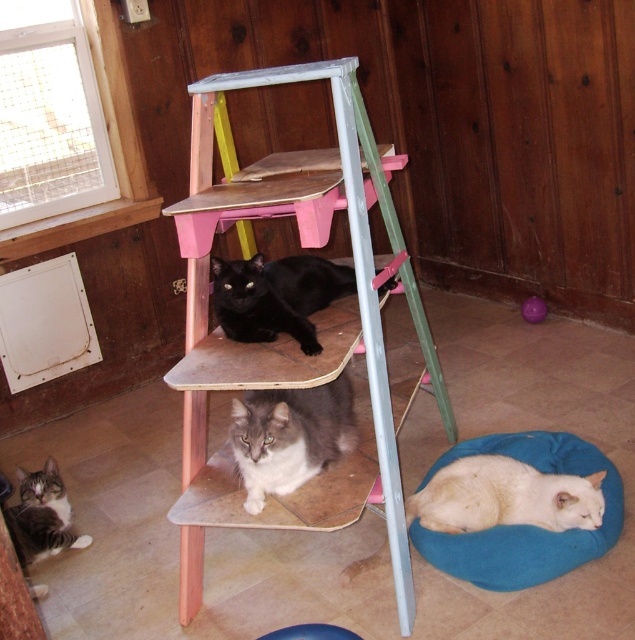
Is point (246, 515) in front of point (218, 276)?

Yes, point (246, 515) is closer to viewer.

Is point (204, 209) positioned behind point (337, 272)?

No.

Describe the element at coordinates (283, 337) in the screenshot. This screenshot has width=635, height=640. I see `pink wood step ladder at center` at that location.

Locate an element on the screen. The height and width of the screenshot is (640, 635). pink wood step ladder at center is located at coordinates (283, 337).

Between pink wood step ladder at center and gray fluffy cat at center, which one has less height?

Standing shorter between the two is gray fluffy cat at center.

Which is behind, point (248, 344) or point (298, 440)?

Positioned behind is point (248, 344).

Locate an element on the screen. This screenshot has height=640, width=635. pink wood step ladder at center is located at coordinates (283, 337).

Which is more to the right, blue fabric dog bed at lower right or gray fluffy cat at center?

blue fabric dog bed at lower right

Does blue fabric dog bed at lower right come behind gray fluffy cat at center?

Answer: Yes, it is behind gray fluffy cat at center.

What are the coordinates of `blue fabric dog bed at lower right` in the screenshot? It's located at (525, 525).